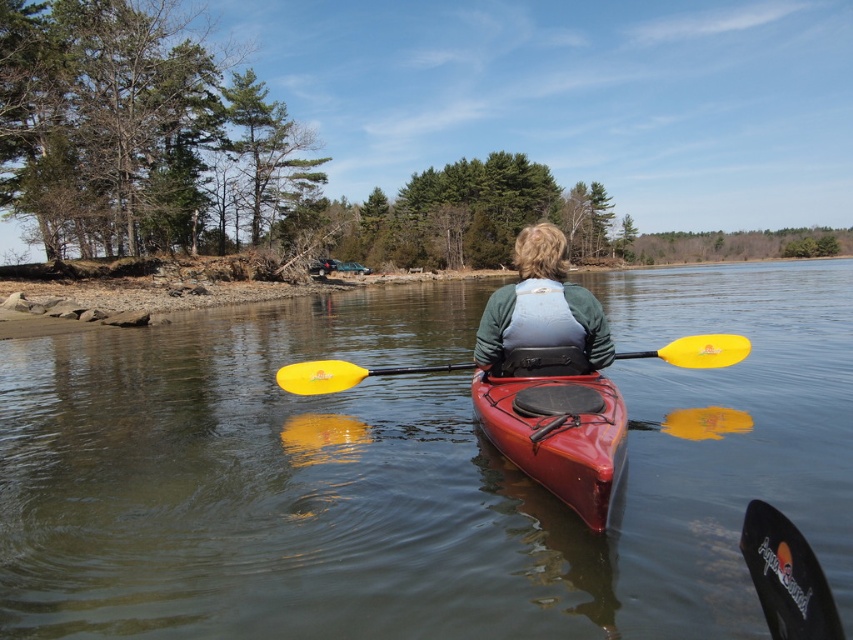
Is point (688, 608) positioned in front of point (596, 364)?

Yes, it is in front of point (596, 364).

Does clear water at center appear on the left side of matte green vest at center?

Incorrect, clear water at center is not on the left side of matte green vest at center.

Who is more forward, (729, 630) or (505, 308)?

Point (729, 630) is in front.

The height and width of the screenshot is (640, 853). Find the location of `clear water at center`. clear water at center is located at coordinates (415, 470).

Is point (274, 493) positioned before point (712, 349)?

Yes, it is.

Which is in front, point (407, 400) or point (287, 385)?

Point (287, 385)

You are a GUI agent. You are given a task and a screenshot of the screen. Output one action in this format:
    pyautogui.click(x=<x>, y=<y>)
    Task: Click on the clear water at center
    This screenshot has height=640, width=853.
    Given the screenshot: What is the action you would take?
    point(415,470)

Can you confirm if matte red kayak at center is positioned to the left of yellow matte paddle at center?

Correct, you'll find matte red kayak at center to the left of yellow matte paddle at center.

Does point (531, 474) come behind point (669, 362)?

That is False.

Where is `matte red kayak at center`? matte red kayak at center is located at coordinates (558, 433).